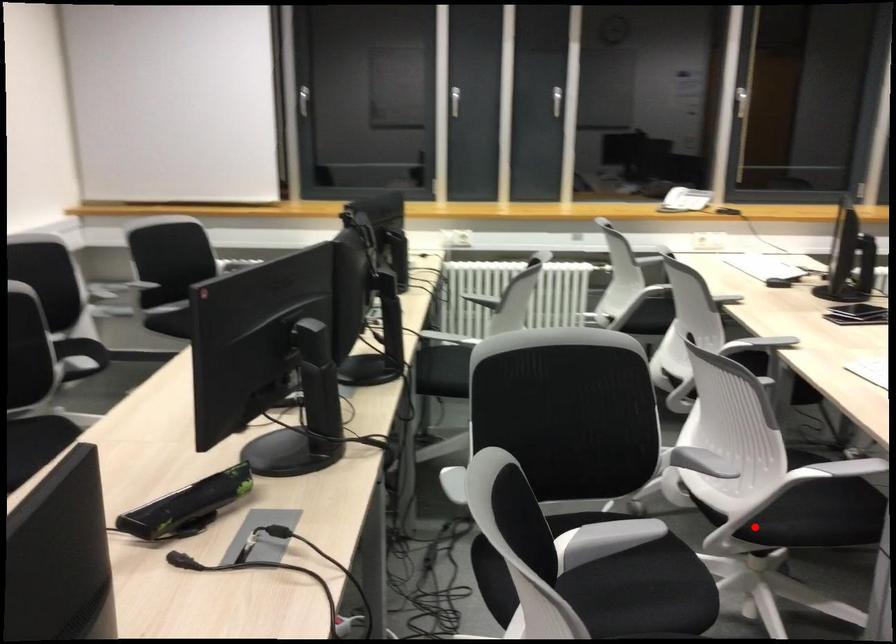
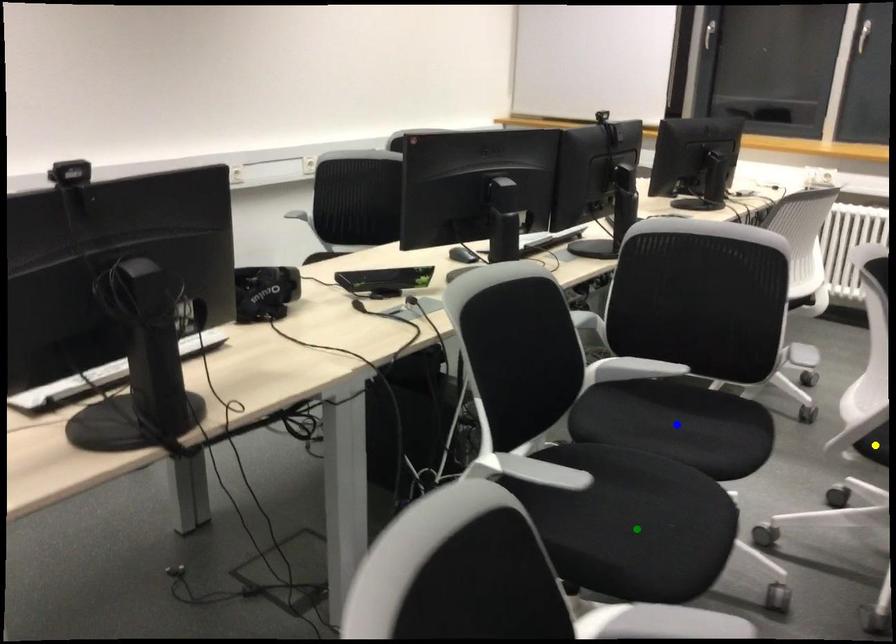
Question: I am providing you with two images of the same scene from different viewpoints. A red point is marked on the first image. You are given multiple points on the second image. In image 2, which mark is for the same physical point as the one in image 1?

Choices:
 (A) green point
 (B) yellow point
 (C) blue point

Answer: (B)